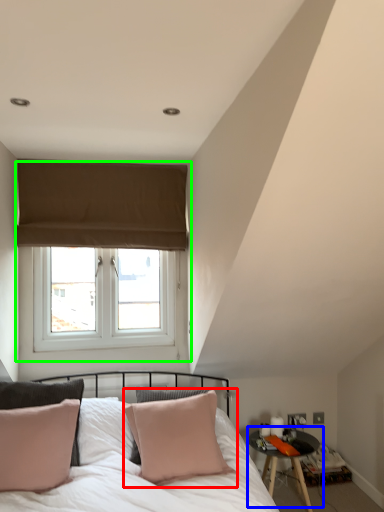
Question: Which object is the closest to the pillow (highlighted by a red box)? Choose among these: table (highlighted by a blue box) or window (highlighted by a green box).

Choices:
 (A) table
 (B) window

Answer: (A)